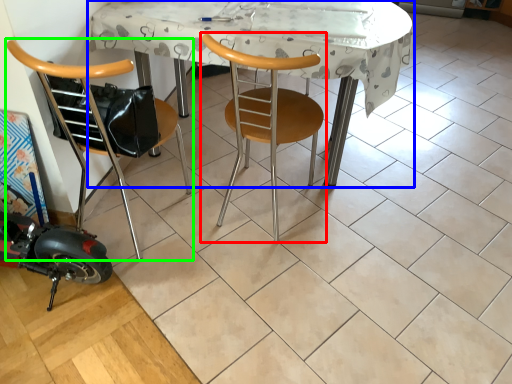
Question: Which object is the closest to the chair (highlighted by a red box)? Choose among these: table (highlighted by a blue box) or chair (highlighted by a green box).

Choices:
 (A) table
 (B) chair

Answer: (A)